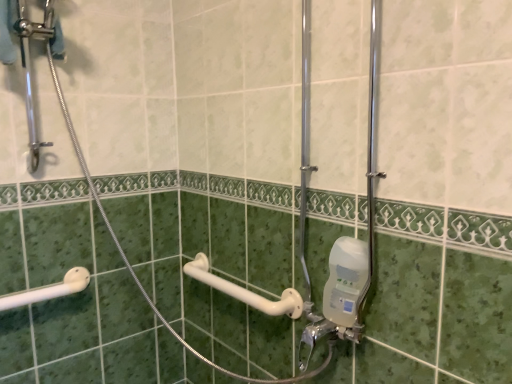
Question: From a real-world perspective, does clear plastic soap dispenser at lower right sit lower than white plastic towel bar at center?

Choices:
 (A) no
 (B) yes

Answer: (A)

Question: Is the position of clear plastic soap dispenser at lower right less distant than that of white plastic towel bar at center?

Choices:
 (A) no
 (B) yes

Answer: (B)

Question: Can you confirm if clear plastic soap dispenser at lower right is thinner than white plastic towel bar at center?

Choices:
 (A) yes
 (B) no

Answer: (A)

Question: Considering the relative positions of clear plastic soap dispenser at lower right and white plastic towel bar at center in the image provided, is clear plastic soap dispenser at lower right to the left of white plastic towel bar at center from the viewer's perspective?

Choices:
 (A) yes
 (B) no

Answer: (B)

Question: Is clear plastic soap dispenser at lower right positioned beyond the bounds of white plastic towel bar at center?

Choices:
 (A) yes
 (B) no

Answer: (A)

Question: From the image's perspective, is clear plastic soap dispenser at lower right positioned above or below white plastic towel bar at center?

Choices:
 (A) above
 (B) below

Answer: (A)

Question: In the image, is clear plastic soap dispenser at lower right positioned in front of or behind white plastic towel bar at center?

Choices:
 (A) behind
 (B) front

Answer: (B)

Question: Considering the positions of clear plastic soap dispenser at lower right and white plastic towel bar at center in the image, is clear plastic soap dispenser at lower right bigger or smaller than white plastic towel bar at center?

Choices:
 (A) big
 (B) small

Answer: (B)

Question: Considering the positions of point (342, 263) and point (263, 306), is point (342, 263) closer or farther from the camera than point (263, 306)?

Choices:
 (A) farther
 (B) closer

Answer: (B)

Question: Considering the positions of clear plastic soap dispenser at lower right and white plastic grab bar at lower left in the image, is clear plastic soap dispenser at lower right taller or shorter than white plastic grab bar at lower left?

Choices:
 (A) tall
 (B) short

Answer: (A)

Question: From the image's perspective, is clear plastic soap dispenser at lower right positioned above or below white plastic grab bar at lower left?

Choices:
 (A) above
 (B) below

Answer: (A)

Question: Is clear plastic soap dispenser at lower right inside the boundaries of white plastic grab bar at lower left, or outside?

Choices:
 (A) inside
 (B) outside

Answer: (B)

Question: Is point (354, 286) positioned closer to the camera than point (61, 292)?

Choices:
 (A) closer
 (B) farther

Answer: (A)

Question: Is point (69, 271) positioned closer to the camera than point (347, 336)?

Choices:
 (A) farther
 (B) closer

Answer: (A)

Question: From their relative heights in the image, would you say white plastic grab bar at lower left is taller or shorter than clear plastic soap dispenser at lower right?

Choices:
 (A) short
 (B) tall

Answer: (A)